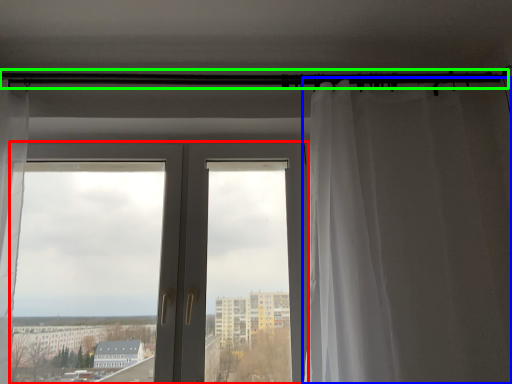
Question: Which is nearer to the door (highlighted by a red box)? curtain (highlighted by a blue box) or beam (highlighted by a green box).

Choices:
 (A) curtain
 (B) beam

Answer: (A)